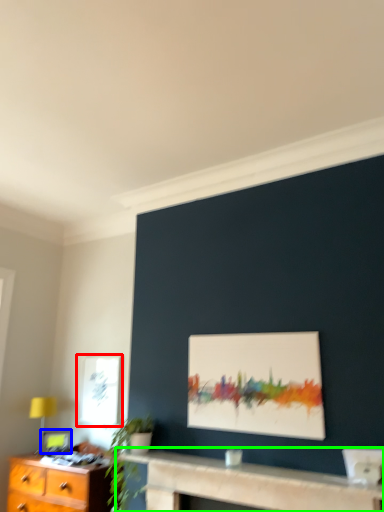
Question: Based on their relative distances, which object is nearer to window (highlighted by a red box)? Choose from picture frame (highlighted by a blue box) and table (highlighted by a green box).

Choices:
 (A) picture frame
 (B) table

Answer: (A)